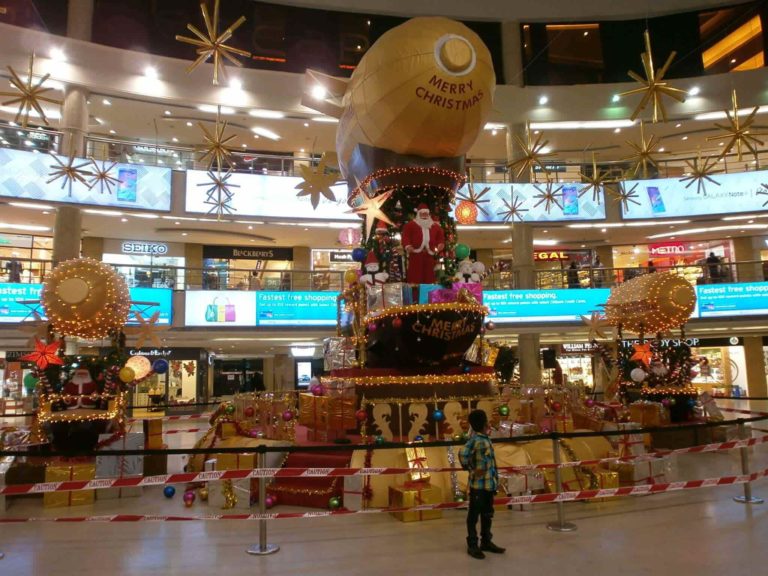
Where is `brown floor`? brown floor is located at coordinates (121, 554).